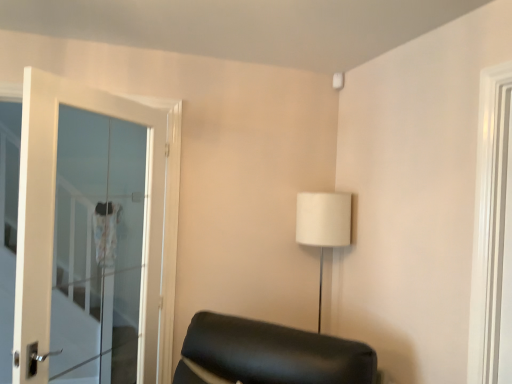
Question: Would you consider white fabric lampshade at upper right to be distant from white glossy door at right?

Choices:
 (A) no
 (B) yes

Answer: (A)

Question: Considering the relative sizes of white fabric lampshade at upper right and white glossy door at right in the image provided, is white fabric lampshade at upper right thinner than white glossy door at right?

Choices:
 (A) yes
 (B) no

Answer: (B)

Question: Is white fabric lampshade at upper right wider than white glossy door at right?

Choices:
 (A) no
 (B) yes

Answer: (B)

Question: Would you say white fabric lampshade at upper right is outside white glossy door at right?

Choices:
 (A) no
 (B) yes

Answer: (B)

Question: Does white fabric lampshade at upper right have a greater height compared to white glossy door at right?

Choices:
 (A) no
 (B) yes

Answer: (A)

Question: Is white glass door at left inside or outside of white fabric lampshade at upper right?

Choices:
 (A) outside
 (B) inside

Answer: (A)

Question: From a real-world perspective, relative to white fabric lampshade at upper right, is white glass door at left vertically above or below?

Choices:
 (A) below
 (B) above

Answer: (B)

Question: Based on their positions, is white glass door at left located to the left or right of white fabric lampshade at upper right?

Choices:
 (A) left
 (B) right

Answer: (A)

Question: Is point (169, 203) closer or farther from the camera than point (312, 228)?

Choices:
 (A) farther
 (B) closer

Answer: (B)

Question: Relative to white glass door at left, is white glossy door at right in front or behind?

Choices:
 (A) front
 (B) behind

Answer: (A)

Question: From the image's perspective, is white glossy door at right positioned above or below white glass door at left?

Choices:
 (A) below
 (B) above

Answer: (B)

Question: In terms of height, does white glossy door at right look taller or shorter compared to white glass door at left?

Choices:
 (A) short
 (B) tall

Answer: (A)

Question: Does point (483, 142) appear closer or farther from the camera than point (48, 210)?

Choices:
 (A) closer
 (B) farther

Answer: (A)

Question: Considering their positions, is white glossy door at right located in front of or behind white fabric lampshade at upper right?

Choices:
 (A) behind
 (B) front

Answer: (B)

Question: Considering the positions of white glossy door at right and white fabric lampshade at upper right in the image, is white glossy door at right wider or thinner than white fabric lampshade at upper right?

Choices:
 (A) thin
 (B) wide

Answer: (A)